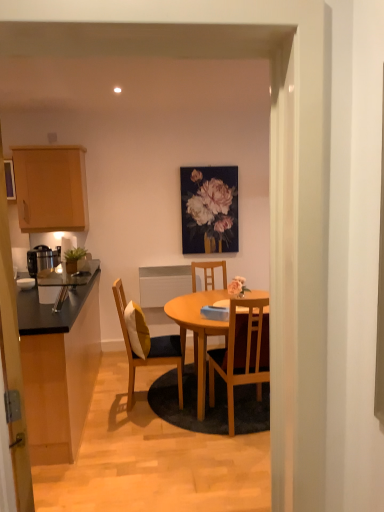
Where is `vacant area on top of matte floral painting at upper center (from a real-world perspective)`? Image resolution: width=384 pixels, height=512 pixels. vacant area on top of matte floral painting at upper center (from a real-world perspective) is located at coordinates (216, 161).